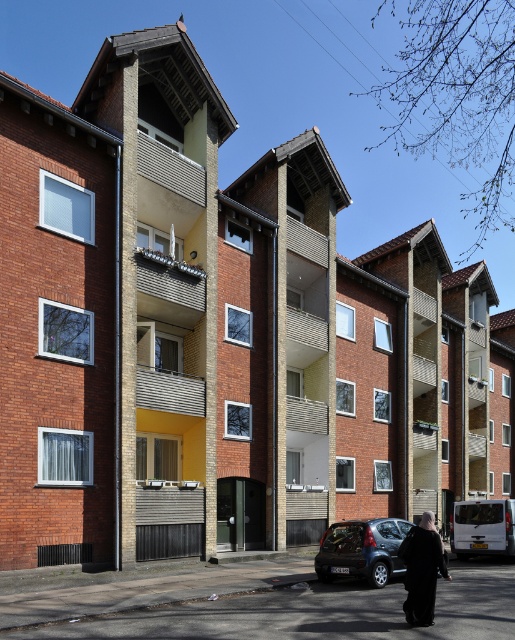
Question: Considering the relative positions of dark gray metallic hatchback at lower center and black matte coat at lower center in the image provided, where is dark gray metallic hatchback at lower center located with respect to black matte coat at lower center?

Choices:
 (A) right
 (B) left

Answer: (B)

Question: Which object is farther from the camera taking this photo?

Choices:
 (A) black matte coat at lower center
 (B) dark gray metallic hatchback at lower center

Answer: (B)

Question: Which point is closer to the camera?

Choices:
 (A) (417, 584)
 (B) (344, 545)

Answer: (A)

Question: Does dark gray metallic hatchback at lower center appear over black matte coat at lower center?

Choices:
 (A) yes
 (B) no

Answer: (B)

Question: Which point is closer to the camera?

Choices:
 (A) black matte coat at lower center
 (B) dark gray metallic hatchback at lower center

Answer: (A)

Question: Can you confirm if dark gray metallic hatchback at lower center is smaller than black matte coat at lower center?

Choices:
 (A) no
 (B) yes

Answer: (A)